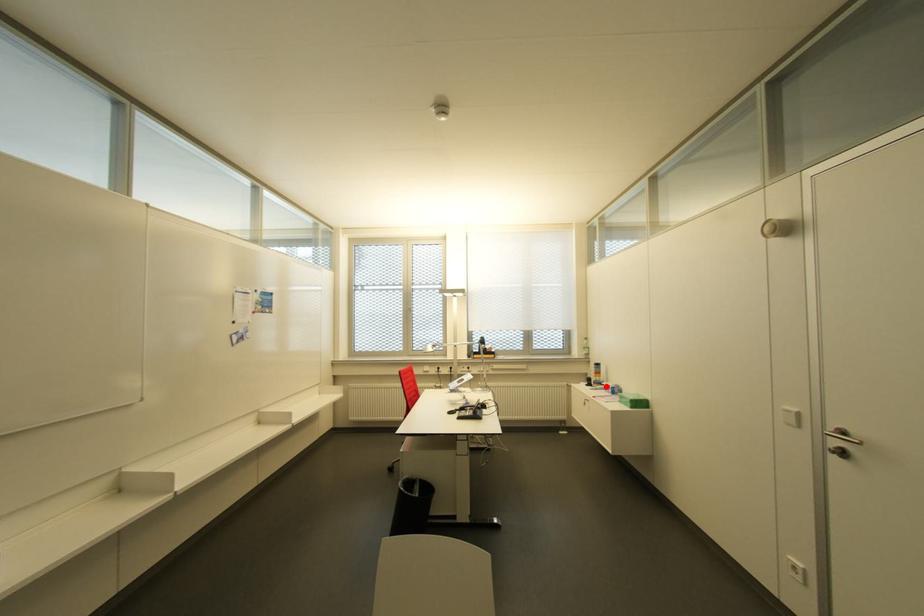
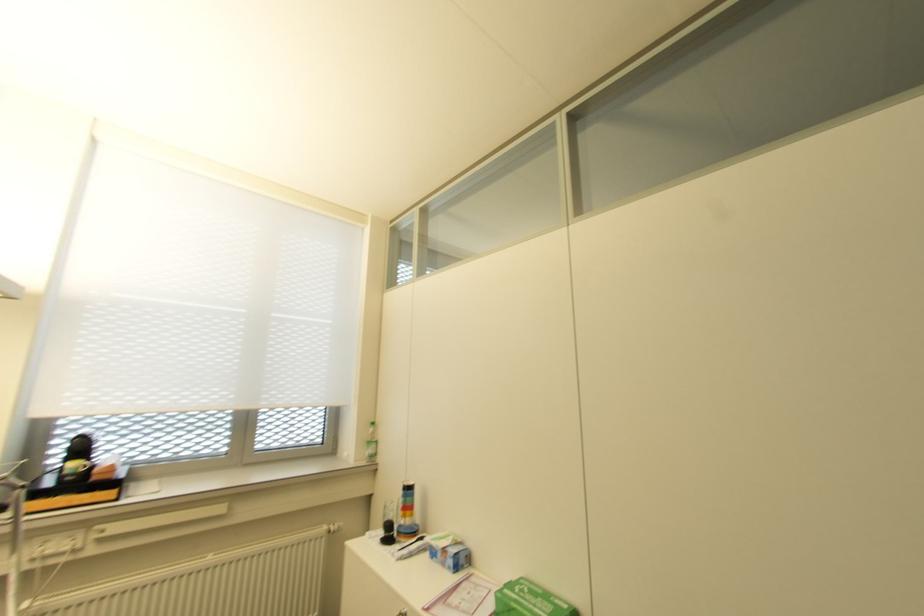
Find the pixel in the second image that matches the highlighted location in the first image.

(441, 549)